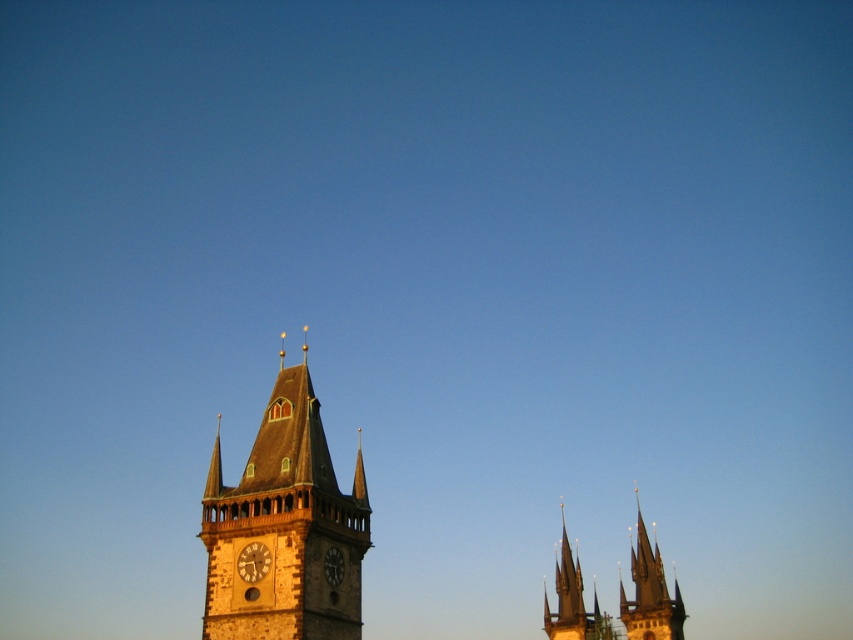
You are standing in the courtyard looking at the stone clock tower at center and the stone spires at center. Which structure is positioned higher in the scene?

The stone clock tower at center is positioned higher than the stone spires at center.

You are an architect planning to place a statue between the stone clock tower at center and the stone spires at center. Which side of the statue should face the wider structure?

The stone clock tower at center might be wider than stone spires at center, so the statue should face the stone clock tower at center.

You are standing at the entrance of a park and see the stone clock tower at center. If you walk directly towards the tower, will you first encounter the additional spires to the right of the tower?

The stone clock tower at center is located at point (283, 525). Since the additional spires are to the right of the tower, walking directly towards the tower would not first encounter the spires but the tower itself.